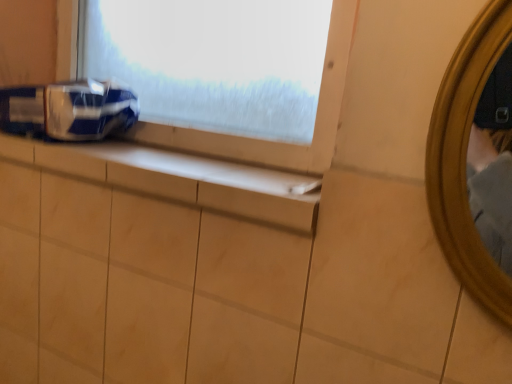
You are a GUI agent. You are given a task and a screenshot of the screen. Output one action in this format:
    pyautogui.click(x=<x>, y=<y>)
    Task: Click on the free space above white tile at lower center (from a real-world perspective)
    The width and height of the screenshot is (512, 384).
    Given the screenshot: What is the action you would take?
    pyautogui.click(x=186, y=157)